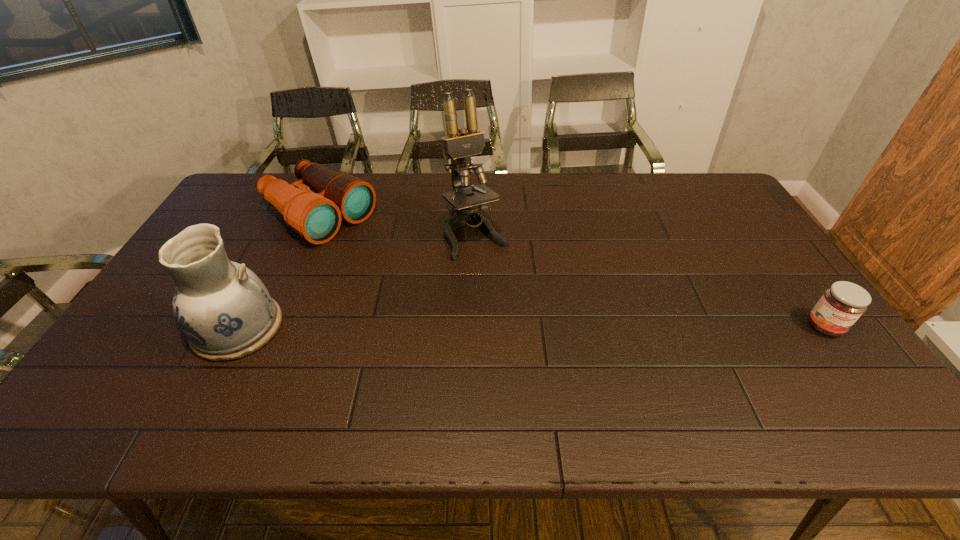
I want to click on free location located 0.360m at the eyepieces of the microscope, so 547,349.

Where is `vacant position located through the lenses of the third tallest object`? The image size is (960, 540). vacant position located through the lenses of the third tallest object is located at coordinates (428, 286).

What are the coordinates of `free space located 0.240m through the lenses of the third tallest object` in the screenshot? It's located at (409, 273).

Locate an element on the screen. The height and width of the screenshot is (540, 960). free space located 0.230m through the lenses of the third tallest object is located at coordinates (406, 272).

In order to click on object located in the far edge section of the desktop in this screenshot , I will do `click(316, 217)`.

Identify the location of object located in the near edge section of the desktop. Image resolution: width=960 pixels, height=540 pixels. (223, 308).

Find the location of a particular element. The width and height of the screenshot is (960, 540). pottery that is positioned at the left edge is located at coordinates (223, 308).

Identify the location of binoculars that is at the left edge. (316, 217).

You are a GUI agent. You are given a task and a screenshot of the screen. Output one action in this format:
    pyautogui.click(x=<x>, y=<y>)
    Task: Click on the object located at the right edge
    This screenshot has height=540, width=960.
    Given the screenshot: What is the action you would take?
    pyautogui.click(x=841, y=305)

Locate an element on the screen. object present at the far left corner is located at coordinates (316, 217).